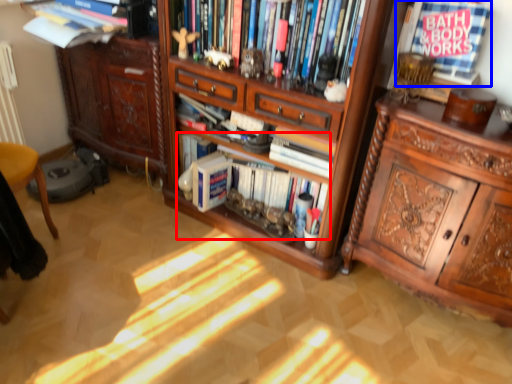
Question: Which object is further to the camera taking this photo, book (highlighted by a red box) or book (highlighted by a blue box)?

Choices:
 (A) book
 (B) book

Answer: (A)